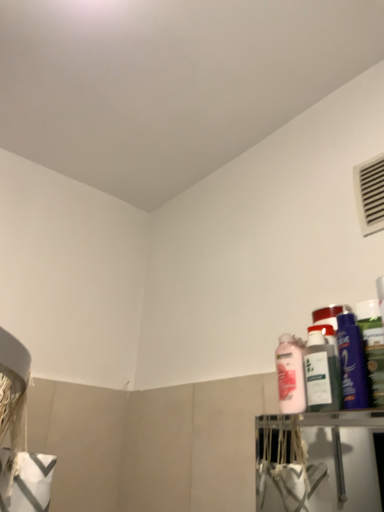
Question: From the image's perspective, would you say shiny purple bottle at right, the 2th cleaning product from the right, is shown under pink matte bottle at upper right?

Choices:
 (A) yes
 (B) no

Answer: (B)

Question: Is shiny purple bottle at right, the 2th cleaning product from the right, to the left of pink matte bottle at upper right from the viewer's perspective?

Choices:
 (A) yes
 (B) no

Answer: (B)

Question: Is shiny purple bottle at right, the 2th cleaning product from the right, not near pink matte bottle at upper right?

Choices:
 (A) no
 (B) yes

Answer: (A)

Question: Can you confirm if shiny purple bottle at right, which is counted as the second cleaning product, starting from the left, is thinner than pink matte bottle at upper right?

Choices:
 (A) no
 (B) yes

Answer: (A)

Question: Does shiny purple bottle at right, the 2th cleaning product from the right, contain pink matte bottle at upper right?

Choices:
 (A) yes
 (B) no

Answer: (B)

Question: Is shiny purple bottle at right, the 2th cleaning product from the right, taller than pink matte bottle at upper right?

Choices:
 (A) no
 (B) yes

Answer: (B)

Question: Is pink glossy lotion at right, marked as the first cleaning product in a left-to-right arrangement, facing towards white plastic air conditioning at upper right?

Choices:
 (A) no
 (B) yes

Answer: (A)

Question: From a real-world perspective, is pink glossy lotion at right, marked as the first cleaning product in a left-to-right arrangement, physically below white plastic air conditioning at upper right?

Choices:
 (A) yes
 (B) no

Answer: (A)

Question: Does pink glossy lotion at right, positioned as the third cleaning product in right-to-left order, have a greater width compared to white plastic air conditioning at upper right?

Choices:
 (A) yes
 (B) no

Answer: (A)

Question: Is white plastic air conditioning at upper right completely or partially inside pink glossy lotion at right, positioned as the third cleaning product in right-to-left order?

Choices:
 (A) yes
 (B) no

Answer: (B)

Question: Is pink glossy lotion at right, positioned as the third cleaning product in right-to-left order, positioned in front of white plastic air conditioning at upper right?

Choices:
 (A) yes
 (B) no

Answer: (A)

Question: From the image's perspective, does pink glossy lotion at right, positioned as the third cleaning product in right-to-left order, appear higher than white plastic air conditioning at upper right?

Choices:
 (A) no
 (B) yes

Answer: (A)

Question: Is shiny purple bottle at right, the 2th cleaning product from the right, at the back of pink glossy lotion at right, positioned as the third cleaning product in right-to-left order?

Choices:
 (A) no
 (B) yes

Answer: (A)